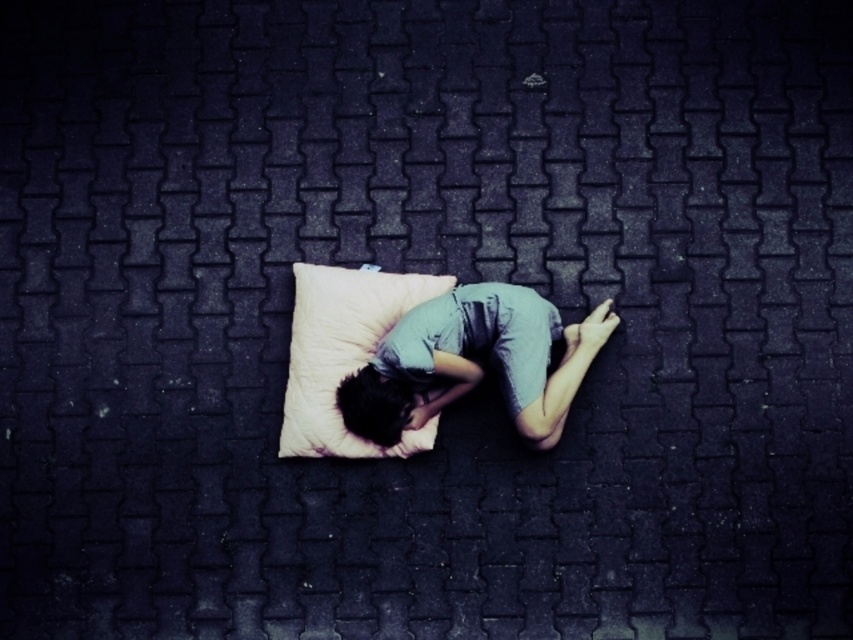
Question: Observing the image, what is the correct spatial positioning of light blue fabric person at center in reference to beige soft pillow at center?

Choices:
 (A) right
 (B) left

Answer: (A)

Question: Observing the image, what is the correct spatial positioning of light blue fabric person at center in reference to beige soft pillow at center?

Choices:
 (A) left
 (B) right

Answer: (B)

Question: Which object appears farthest from the camera in this image?

Choices:
 (A) beige soft pillow at center
 (B) light blue fabric person at center

Answer: (A)

Question: Which point appears farthest from the camera in this image?

Choices:
 (A) (549, 397)
 (B) (416, 444)

Answer: (B)

Question: Can you confirm if light blue fabric person at center is positioned to the left of beige soft pillow at center?

Choices:
 (A) yes
 (B) no

Answer: (B)